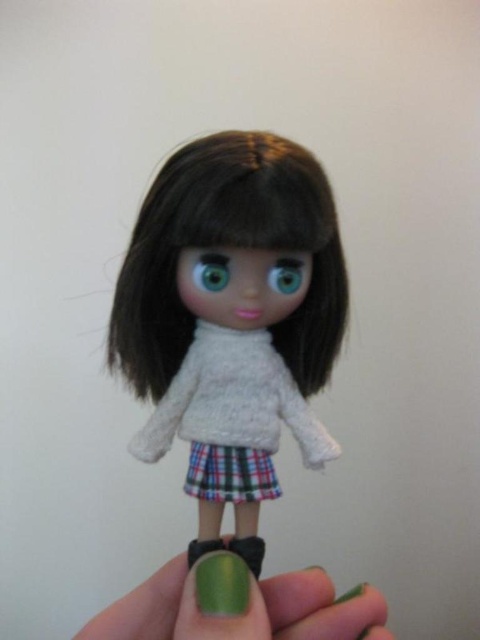
Question: Among these points, which one is farthest from the camera?

Choices:
 (A) (286, 260)
 (B) (199, 272)
 (C) (249, 168)

Answer: (A)

Question: Which object appears farthest from the camera in this image?

Choices:
 (A) green metallic nail polish at lower center
 (B) green matte eye at center

Answer: (B)

Question: Which of the following is the farthest from the observer?

Choices:
 (A) (147, 269)
 (B) (110, 612)

Answer: (B)

Question: Does white knitted sweater at center lie behind green metallic nail polish at lower center?

Choices:
 (A) yes
 (B) no

Answer: (A)

Question: Does white knitted sweater at center have a larger size compared to green metallic nail polish at lower center?

Choices:
 (A) no
 (B) yes

Answer: (A)

Question: In this image, where is white knitted sweater at center located relative to blue glossy eye at center?

Choices:
 (A) below
 (B) above

Answer: (A)